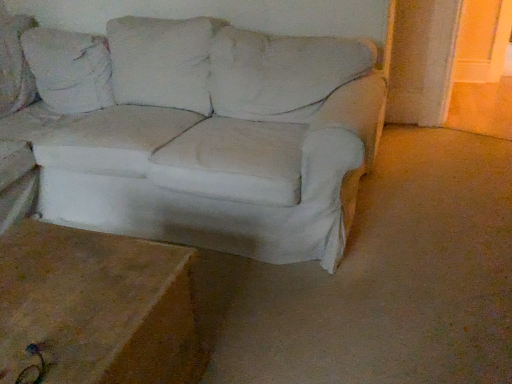
This screenshot has height=384, width=512. What are the coordinates of `free space above brown wood table at lower left (from a real-world perspective)` in the screenshot? It's located at (69, 291).